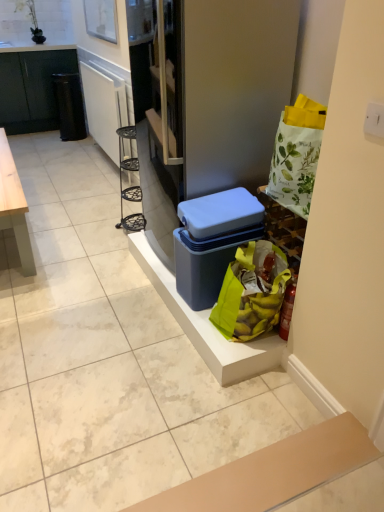
Image resolution: width=384 pixels, height=512 pixels. What do you see at coordinates (32, 89) in the screenshot?
I see `black matte cabinet at left` at bounding box center [32, 89].

The image size is (384, 512). Describe the element at coordinates (251, 292) in the screenshot. I see `banana-patterned fabric bag at lower right` at that location.

Identify the location of blue plastic storage box at center. (212, 241).

What is the approximate height of black plastic trash can at left?

black plastic trash can at left is 70.25 centimeters tall.

Measure the distance between point (62, 109) and camera.

The depth of point (62, 109) is 15.10 feet.

This screenshot has width=384, height=512. I want to click on black matte cabinet at left, so click(32, 89).

Is blue plastic storage box at center aimed at matte white fridge at center?

No, blue plastic storage box at center is not turned towards matte white fridge at center.

Between blue plastic storage box at center and matte white fridge at center, which one has smaller size?

With smaller size is blue plastic storage box at center.

Which is closer, (211, 252) or (253, 5)?

Point (211, 252) appears to be farther away from the viewer than point (253, 5).

The image size is (384, 512). Identify the location of fridge on the left of blue plastic storage box at center. (233, 89).

Can you tell me how much black matte cabinet at left and banana-patterned fabric bag at lower right differ in facing direction?

There is a 89.5-degree angle between the facing directions of black matte cabinet at left and banana-patterned fabric bag at lower right.

In order to click on cabinetry above the banana-patterned fabric bag at lower right (from the image's perspective) in this screenshot , I will do `click(32, 89)`.

Considering the sizes of objects black matte cabinet at left and banana-patterned fabric bag at lower right in the image provided, who is thinner, black matte cabinet at left or banana-patterned fabric bag at lower right?

banana-patterned fabric bag at lower right is thinner.

Consider the image. Is black matte cabinet at left to the left of banana-patterned fabric bag at lower right from the viewer's perspective?

Yes, black matte cabinet at left is to the left of banana-patterned fabric bag at lower right.

From their relative heights in the image, would you say matte white fridge at center is taller or shorter than black plastic trash can at left?

In the image, matte white fridge at center appears to be taller than black plastic trash can at left.

Visually, is matte white fridge at center positioned to the left or to the right of black plastic trash can at left?

Clearly, matte white fridge at center is on the right of black plastic trash can at left in the image.

Could you tell me if matte white fridge at center is turned towards black plastic trash can at left?

No, matte white fridge at center is not turned towards black plastic trash can at left.

Which is closer to the camera, (222, 6) or (63, 94)?

Clearly, point (222, 6) is closer to the camera than point (63, 94).

Based on the photo, which object is positioned more to the left, black matte cabinet at left or blue plastic storage box at center?

Positioned to the left is black matte cabinet at left.

Considering the relative positions of black matte cabinet at left and blue plastic storage box at center in the image provided, is black matte cabinet at left in front of blue plastic storage box at center?

No, black matte cabinet at left is behind blue plastic storage box at center.

Is blue plastic storage box at center inside black matte cabinet at left?

Definitely not — blue plastic storage box at center is not inside black matte cabinet at left.

Considering the relative sizes of black matte cabinet at left and blue plastic storage box at center in the image provided, is black matte cabinet at left bigger than blue plastic storage box at center?

Yes.

What's the angular difference between matte white fridge at center and blue plastic storage box at center's facing directions?

They differ by 0.00243 degrees in their facing directions.

Where is `storage box on the right of matte white fridge at center`? storage box on the right of matte white fridge at center is located at coordinates (212, 241).

Can we say matte white fridge at center lies outside blue plastic storage box at center?

matte white fridge at center lies outside blue plastic storage box at center's area.

From the image's perspective, between matte white fridge at center and blue plastic storage box at center, who is located below?

blue plastic storage box at center, from the image's perspective.

From a real-world perspective, is matte white fridge at center positioned over black matte cabinet at left based on gravity?

Yes, from a real-world perspective, matte white fridge at center is over black matte cabinet at left

Considering the sizes of matte white fridge at center and black matte cabinet at left in the image, is matte white fridge at center bigger or smaller than black matte cabinet at left?

Considering their sizes, matte white fridge at center takes up less space than black matte cabinet at left.

Between matte white fridge at center and black matte cabinet at left, which one has less height?

With less height is black matte cabinet at left.

Looking at this image, could you tell me if black plastic trash can at left is turned towards blue plastic storage box at center?

No, black plastic trash can at left does not turn towards blue plastic storage box at center.

Measure the distance from black plastic trash can at left to blue plastic storage box at center.

black plastic trash can at left and blue plastic storage box at center are 3.21 meters apart from each other.

Who is taller, black plastic trash can at left or blue plastic storage box at center?

Standing taller between the two is black plastic trash can at left.

Is black plastic trash can at left wider than blue plastic storage box at center?

In fact, black plastic trash can at left might be narrower than blue plastic storage box at center.

Locate an element on the screen. This screenshot has height=512, width=384. fridge in front of the blue plastic storage box at center is located at coordinates (233, 89).

Locate an element on the screen. The width and height of the screenshot is (384, 512). shopping bag to the right of black matte cabinet at left is located at coordinates (251, 292).

From the picture: Estimate the real-world distances between objects in this image. Which object is further from black matte cabinet at left, black plastic trash can at left or blue plastic storage box at center?

blue plastic storage box at center is positioned further to the anchor black matte cabinet at left.

Estimate the real-world distances between objects in this image. Which object is further from matte white fridge at center, black matte cabinet at left or blue plastic storage box at center?

black matte cabinet at left lies further to matte white fridge at center than the other object.

In the scene shown: Based on their spatial positions, is matte white fridge at center or black matte cabinet at left further from black plastic trash can at left?

Based on the image, matte white fridge at center appears to be further to black plastic trash can at left.

Looking at the image, which one is located further to banana-patterned fabric bag at lower right, black matte cabinet at left or matte white fridge at center?

black matte cabinet at left lies further to banana-patterned fabric bag at lower right than the other object.

Considering their positions, is banana-patterned fabric bag at lower right positioned further to black plastic trash can at left than matte white fridge at center?

banana-patterned fabric bag at lower right is positioned further to the anchor black plastic trash can at left.

In the scene shown: Looking at the image, which one is located further to black plastic trash can at left, matte white fridge at center or blue plastic storage box at center?

blue plastic storage box at center is further to black plastic trash can at left.

Estimate the real-world distances between objects in this image. Which object is further from banana-patterned fabric bag at lower right, black matte cabinet at left or blue plastic storage box at center?

Among the two, black matte cabinet at left is located further to banana-patterned fabric bag at lower right.

From the image, which object appears to be farther from banana-patterned fabric bag at lower right, blue plastic storage box at center or black matte cabinet at left?

black matte cabinet at left is positioned further to the anchor banana-patterned fabric bag at lower right.

The image size is (384, 512). In order to click on storage box located between banana-patterned fabric bag at lower right and black plastic trash can at left in the depth direction in this screenshot , I will do `click(212, 241)`.

The width and height of the screenshot is (384, 512). I want to click on storage box between matte white fridge at center and banana-patterned fabric bag at lower right in the up-down direction, so click(x=212, y=241).

At what (x,y) coordinates should I click in order to perform the action: click on storage box between matte white fridge at center and black matte cabinet at left along the z-axis. Please return your answer as a coordinate pair (x, y). Looking at the image, I should click on (212, 241).

Locate an element on the screen. shopping bag between matte white fridge at center and black matte cabinet at left in the front-back direction is located at coordinates (251, 292).